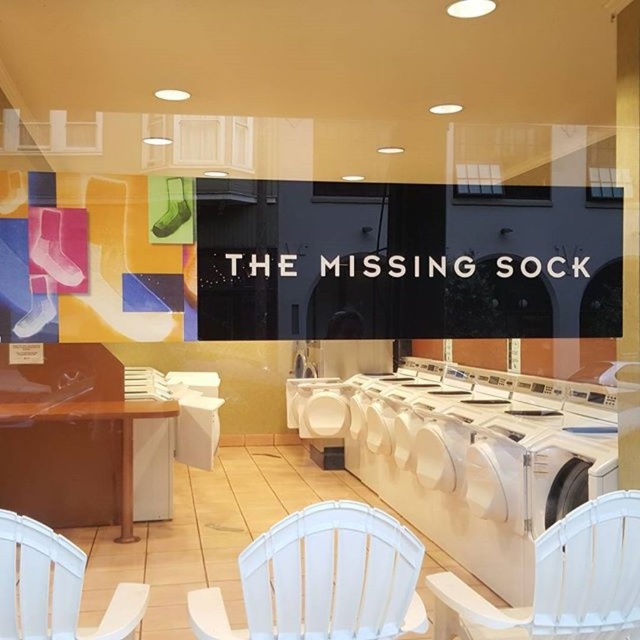
Question: Does white plastic washer at center have a greater width compared to white plastic chair at lower left?

Choices:
 (A) no
 (B) yes

Answer: (B)

Question: Can you confirm if white plastic washer at center is positioned to the right of white plastic chair at center?

Choices:
 (A) no
 (B) yes

Answer: (B)

Question: Which of the following is the farthest from the observer?

Choices:
 (A) (307, 573)
 (B) (483, 547)
 (C) (138, 605)

Answer: (B)

Question: Which object is the farthest from the white plastic chair at lower left?

Choices:
 (A) white plastic chair at lower right
 (B) white plastic washer at center

Answer: (B)

Question: In this image, where is white plastic washer at center located relative to white plastic chair at lower right?

Choices:
 (A) above
 (B) below

Answer: (A)

Question: Which object is closer to the camera taking this photo?

Choices:
 (A) white plastic chair at center
 (B) white plastic chair at lower right
 (C) white plastic washer at center
 (D) white plastic chair at lower left

Answer: (D)